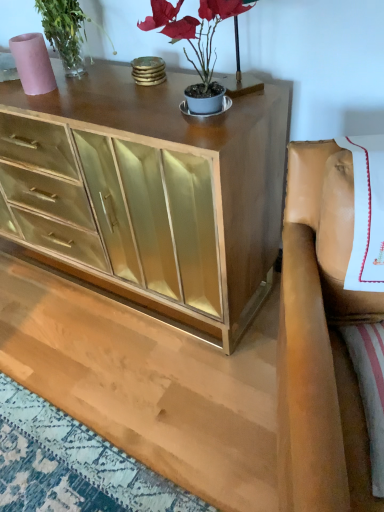
This screenshot has height=512, width=384. What are the coordinates of `blank area to the left of matte gold plant at upper center` in the screenshot? It's located at (119, 115).